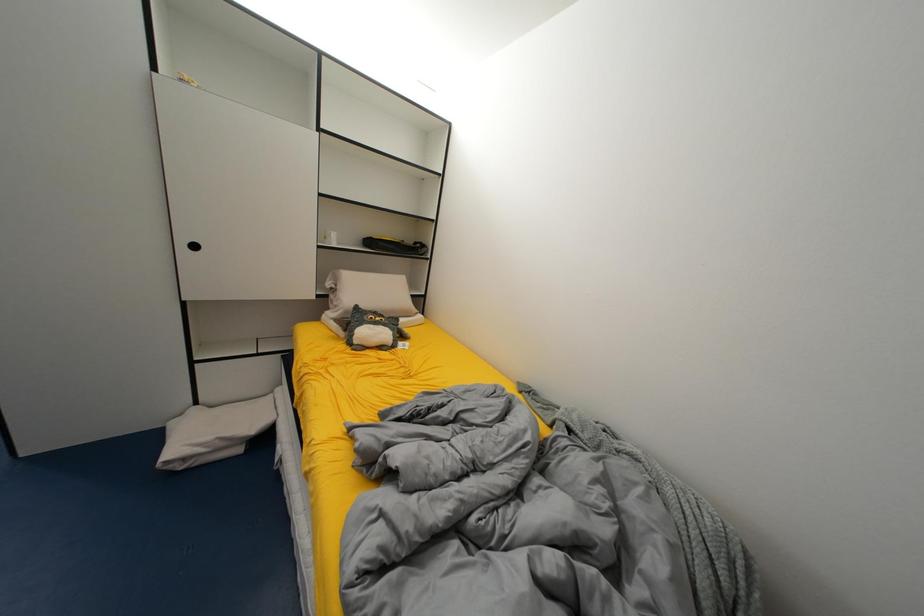
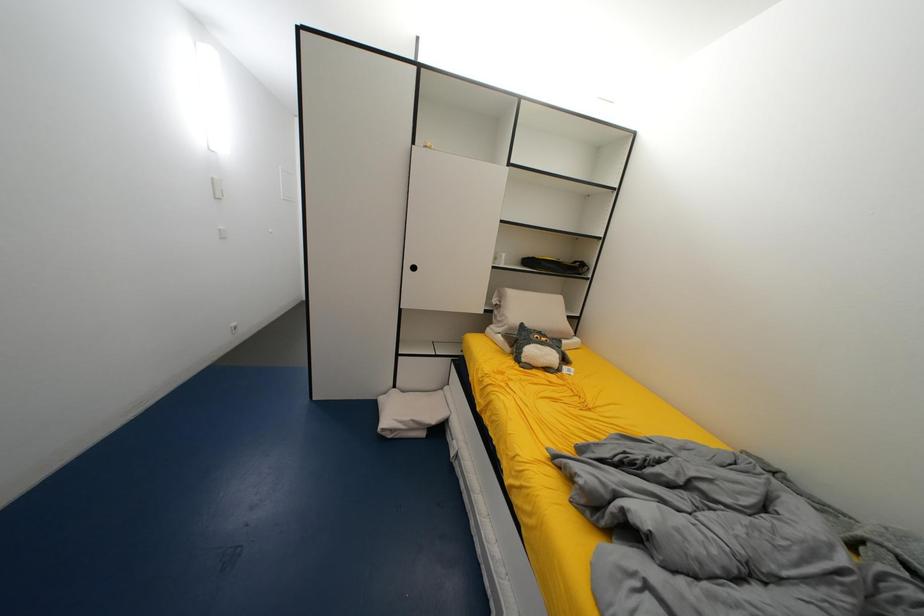
Question: The camera is either moving clockwise (left) or counter-clockwise (right) around the object. The first image is from the beginning of the video and the second image is from the end. Is the camera moving left or right when shooting the video?

Choices:
 (A) Left
 (B) Right

Answer: (B)